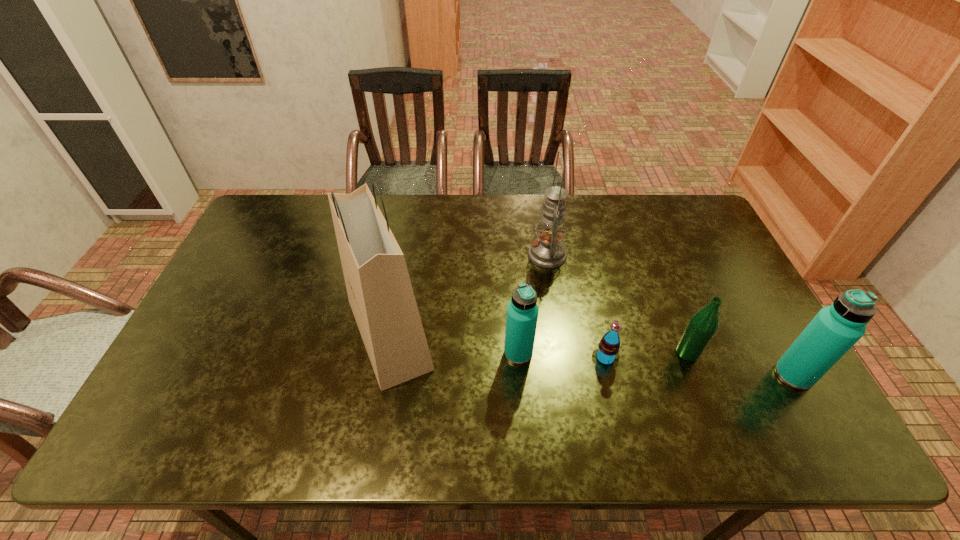
Locate an element on the screen. The image size is (960, 540). object located at the right edge is located at coordinates click(x=835, y=329).

Identify the location of object that is at the near right corner. (835, 329).

Find the location of a particular element. blank space at the far edge of the desktop is located at coordinates (512, 221).

Identify the location of free location at the near edge of the desktop. (494, 399).

Identify the location of free region at the left edge. Image resolution: width=960 pixels, height=540 pixels. (284, 259).

What are the coordinates of `free space at the right edge of the desktop` in the screenshot? It's located at (707, 278).

Where is `vacant space at the far right corner of the desktop`? vacant space at the far right corner of the desktop is located at coordinates (684, 227).

I want to click on vacant space at the near right corner of the desktop, so click(777, 399).

Where is `free spot between the fifth tallest object and the third object from right to left`? This screenshot has width=960, height=540. free spot between the fifth tallest object and the third object from right to left is located at coordinates (646, 355).

Where is `free point between the shortest object and the fourth object from right to left`? The width and height of the screenshot is (960, 540). free point between the shortest object and the fourth object from right to left is located at coordinates pyautogui.click(x=576, y=306).